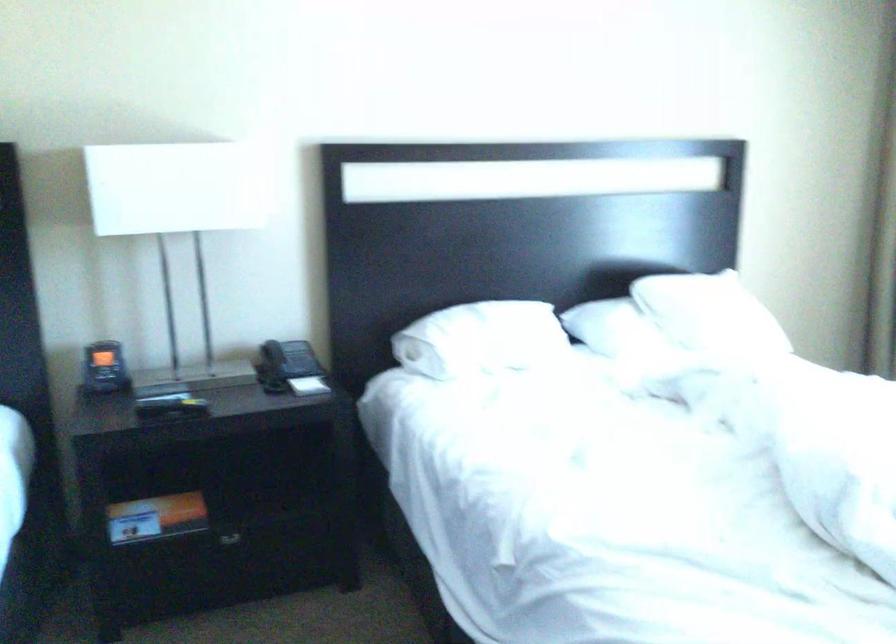
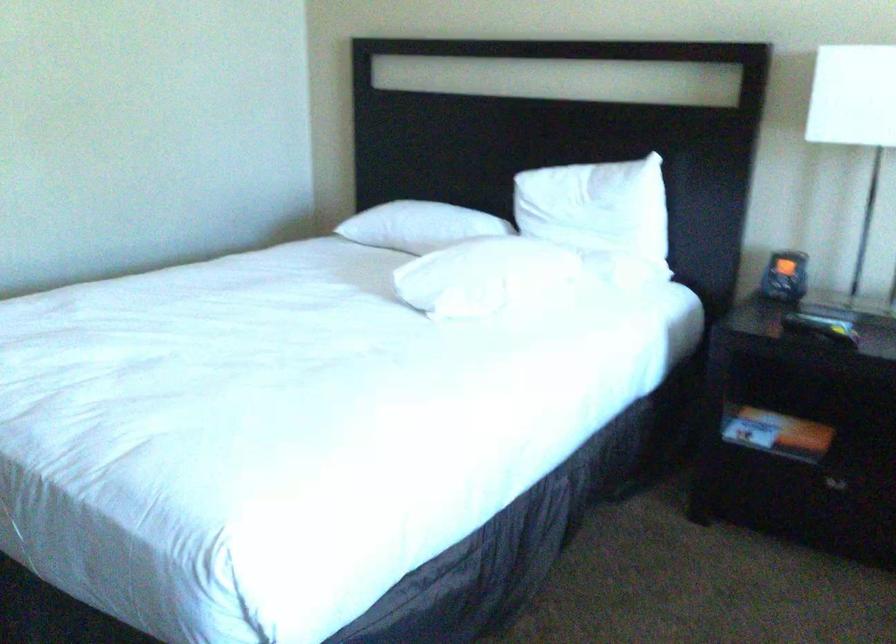
Question: The camera is either moving clockwise (left) or counter-clockwise (right) around the object. The first image is from the beginning of the video and the second image is from the end. Is the camera moving left or right when shooting the video?

Choices:
 (A) Left
 (B) Right

Answer: (B)